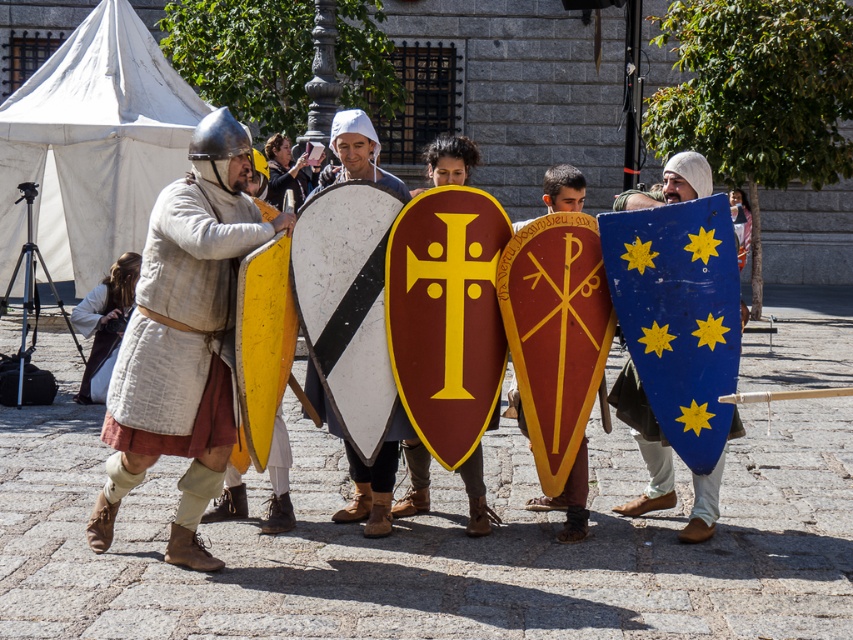
You are a knight in the medieval reenactment and need to choose a shield that is taller for better protection. Which shield should you pick between the matte white shield at center and the blue painted wood shield at center?

The blue painted wood shield at center is taller than the matte white shield at center, so you should choose the blue painted wood shield at center for better protection.

Based on the photo, you are a knight in the medieval festival and you need to find your shield. You remember your shield is the one on the left side of the other shield. Which shield should you choose between the blue painted wood shield at center and the matte gold shield at center?

The blue painted wood shield at center is to the right of the matte gold shield at center, so the matte gold shield at center is on the left side. You should choose the matte gold shield at center.